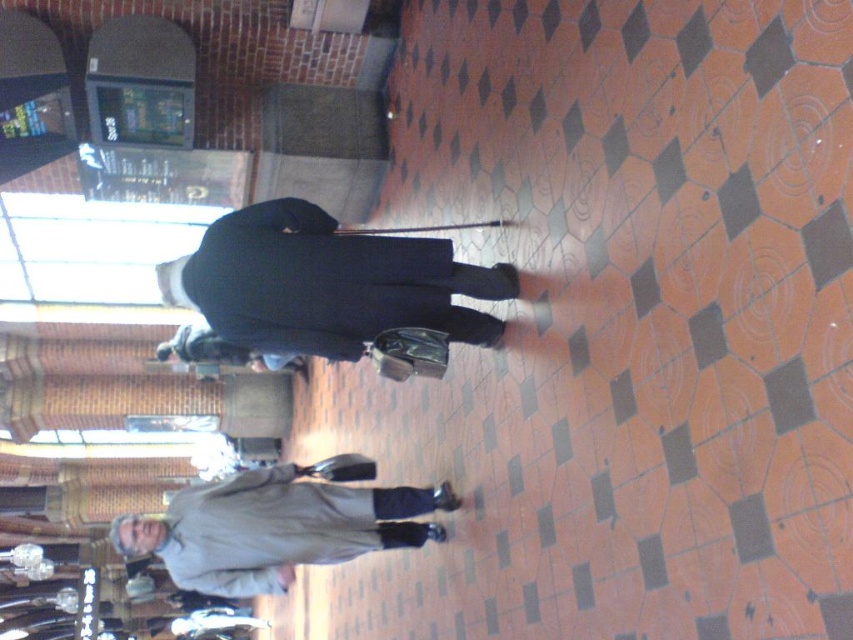
Question: Which object is closer to the camera taking this photo?

Choices:
 (A) dark wool coat at center
 (B) light gray fabric coat at lower center

Answer: (A)

Question: Is dark wool coat at center to the left of light gray fabric coat at lower center from the viewer's perspective?

Choices:
 (A) no
 (B) yes

Answer: (A)

Question: Is dark wool coat at center thinner than light gray fabric coat at lower center?

Choices:
 (A) yes
 (B) no

Answer: (A)

Question: Which of the following is the farthest from the observer?

Choices:
 (A) light gray fabric coat at lower center
 (B) dark wool coat at center

Answer: (A)

Question: Is dark wool coat at center positioned at the back of light gray fabric coat at lower center?

Choices:
 (A) yes
 (B) no

Answer: (B)